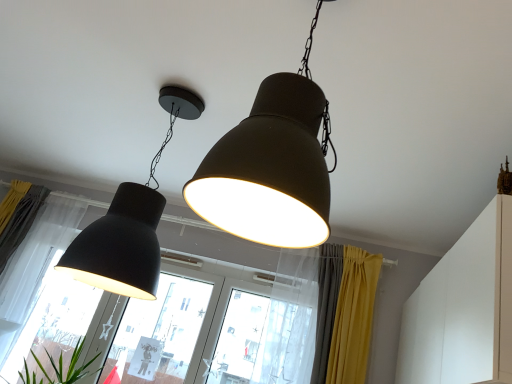
Question: Is transparent glass window at center, acting as the second window starting from the left, at the back of matte black lampshade at left?

Choices:
 (A) no
 (B) yes

Answer: (B)

Question: Does matte black lampshade at left turn towards transparent glass window at center, acting as the second window starting from the left?

Choices:
 (A) no
 (B) yes

Answer: (B)

Question: From the image's perspective, is matte black lampshade at left on transparent glass window at center, which is the second window from right to left?

Choices:
 (A) yes
 (B) no

Answer: (B)

Question: Considering the relative sizes of matte black lampshade at left and transparent glass window at center, which is the second window from right to left, in the image provided, is matte black lampshade at left taller than transparent glass window at center, which is the second window from right to left,?

Choices:
 (A) no
 (B) yes

Answer: (A)

Question: Is matte black lampshade at left to the right of transparent glass window at center, acting as the second window starting from the left, from the viewer's perspective?

Choices:
 (A) no
 (B) yes

Answer: (A)

Question: Considering the positions of matte black lampshade at center, the first lamp in the front-to-back sequence, and white sheer curtain at left, arranged as the 3th curtain when viewed from the right, in the image, is matte black lampshade at center, the first lamp in the front-to-back sequence, taller or shorter than white sheer curtain at left, arranged as the 3th curtain when viewed from the right,?

Choices:
 (A) tall
 (B) short

Answer: (B)

Question: Considering their positions, is matte black lampshade at center, the first lamp in the front-to-back sequence, located in front of or behind white sheer curtain at left, which is the first curtain in left-to-right order?

Choices:
 (A) behind
 (B) front

Answer: (B)

Question: Would you say matte black lampshade at center, arranged as the first lamp when viewed from the right, is inside or outside white sheer curtain at left, arranged as the 3th curtain when viewed from the right?

Choices:
 (A) outside
 (B) inside

Answer: (A)

Question: Based on their positions, is matte black lampshade at center, placed as the 2th lamp when sorted from back to front, located to the left or right of white sheer curtain at left, which is the first curtain in left-to-right order?

Choices:
 (A) left
 (B) right

Answer: (B)

Question: From the image's perspective, is white matte cabinet at upper right above or below white sheer curtain at left, arranged as the 3th curtain when viewed from the right?

Choices:
 (A) below
 (B) above

Answer: (A)

Question: In the image, is white matte cabinet at upper right on the left side or the right side of white sheer curtain at left, which is the first curtain in left-to-right order?

Choices:
 (A) right
 (B) left

Answer: (A)

Question: In terms of size, does white matte cabinet at upper right appear bigger or smaller than white sheer curtain at left, which is the first curtain in left-to-right order?

Choices:
 (A) big
 (B) small

Answer: (A)

Question: Is white matte cabinet at upper right spatially inside white sheer curtain at left, arranged as the 3th curtain when viewed from the right, or outside of it?

Choices:
 (A) outside
 (B) inside

Answer: (A)

Question: Considering their positions, is white sheer curtain at left, which is the first curtain in left-to-right order, located in front of or behind transparent glass window at center, the first window from the right?

Choices:
 (A) front
 (B) behind

Answer: (B)

Question: Based on their positions, is white sheer curtain at left, which is the first curtain in left-to-right order, located to the left or right of transparent glass window at center, arranged as the 3th window when viewed from the left?

Choices:
 (A) right
 (B) left

Answer: (B)